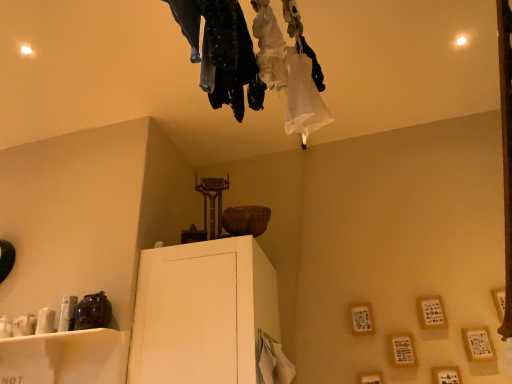
Question: Is there a large distance between dark textured pants at upper center and white matte cabinet at center, the first furniture viewed from the right?

Choices:
 (A) yes
 (B) no

Answer: (A)

Question: Considering the relative sizes of dark textured pants at upper center and white matte cabinet at center, the first furniture viewed from the right, in the image provided, is dark textured pants at upper center wider than white matte cabinet at center, the first furniture viewed from the right,?

Choices:
 (A) no
 (B) yes

Answer: (A)

Question: Is dark textured pants at upper center taller than white matte cabinet at center, the first furniture viewed from the right?

Choices:
 (A) yes
 (B) no

Answer: (B)

Question: Does dark textured pants at upper center contain white matte cabinet at center, which appears as the second furniture when viewed from the left?

Choices:
 (A) no
 (B) yes

Answer: (A)

Question: Is dark textured pants at upper center facing towards white matte cabinet at center, which appears as the second furniture when viewed from the left?

Choices:
 (A) no
 (B) yes

Answer: (A)

Question: Is white glossy shelf at lower left, the 1th furniture in the left-to-right sequence, bigger or smaller than white matte cabinet at center, the first furniture viewed from the right?

Choices:
 (A) big
 (B) small

Answer: (B)

Question: Considering the positions of point (10, 365) and point (269, 311), is point (10, 365) closer or farther from the camera than point (269, 311)?

Choices:
 (A) farther
 (B) closer

Answer: (B)

Question: From their relative heights in the image, would you say white glossy shelf at lower left, which is the 2th furniture in right-to-left order, is taller or shorter than white matte cabinet at center, which appears as the second furniture when viewed from the left?

Choices:
 (A) tall
 (B) short

Answer: (B)

Question: In the image, is white glossy shelf at lower left, the 1th furniture in the left-to-right sequence, positioned in front of or behind white matte cabinet at center, which appears as the second furniture when viewed from the left?

Choices:
 (A) front
 (B) behind

Answer: (A)

Question: Is point (245, 49) positioned closer to the camera than point (246, 369)?

Choices:
 (A) farther
 (B) closer

Answer: (B)

Question: From a real-world perspective, is dark textured pants at upper center above or below white matte cabinet at center, the first furniture viewed from the right?

Choices:
 (A) below
 (B) above

Answer: (B)

Question: Considering the positions of dark textured pants at upper center and white matte cabinet at center, the first furniture viewed from the right, in the image, is dark textured pants at upper center taller or shorter than white matte cabinet at center, the first furniture viewed from the right,?

Choices:
 (A) tall
 (B) short

Answer: (B)

Question: In the image, is dark textured pants at upper center on the left side or the right side of white matte cabinet at center, which appears as the second furniture when viewed from the left?

Choices:
 (A) left
 (B) right

Answer: (B)

Question: Relative to white glossy shelf at lower left, the 1th furniture in the left-to-right sequence, is white matte cabinet at center, the first furniture viewed from the right, in front or behind?

Choices:
 (A) behind
 (B) front

Answer: (A)

Question: From a real-world perspective, relative to white glossy shelf at lower left, the 1th furniture in the left-to-right sequence, is white matte cabinet at center, the first furniture viewed from the right, vertically above or below?

Choices:
 (A) below
 (B) above

Answer: (B)